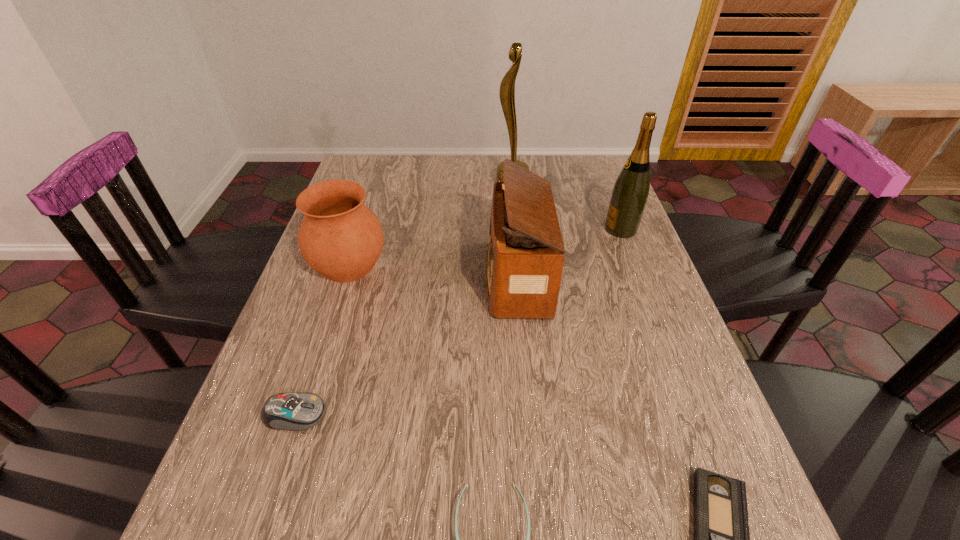
At what (x,y) coordinates should I click in order to perform the action: click on award. Please return your answer as a coordinate pair (x, y). Looking at the image, I should click on (507, 87).

This screenshot has height=540, width=960. What are the coordinates of `the farthest object` in the screenshot? It's located at (507, 87).

Where is `wine bottle`? wine bottle is located at coordinates (630, 192).

This screenshot has width=960, height=540. What are the coordinates of `the sixth shortest object` in the screenshot? It's located at (630, 192).

You are a GUI agent. You are given a task and a screenshot of the screen. Output one action in this format:
    pyautogui.click(x=<x>, y=<y>)
    Task: Click on the radio receiver
    This screenshot has height=540, width=960.
    Given the screenshot: What is the action you would take?
    pyautogui.click(x=525, y=256)

What are the coordinates of `pottery` in the screenshot? It's located at (341, 238).

The image size is (960, 540). Identify the location of the fifth farthest object. (298, 411).

Where is `vacant area situated 0.240m on the front-facing side of the award`? Image resolution: width=960 pixels, height=540 pixels. vacant area situated 0.240m on the front-facing side of the award is located at coordinates (420, 184).

Image resolution: width=960 pixels, height=540 pixels. I want to click on free spot located 0.360m on the front-facing side of the award, so click(383, 184).

At what (x,y) coordinates should I click in order to perform the action: click on free spot located 0.320m on the front-facing side of the award. Please return your answer as a coordinate pair (x, y). This screenshot has width=960, height=540. Looking at the image, I should click on (396, 184).